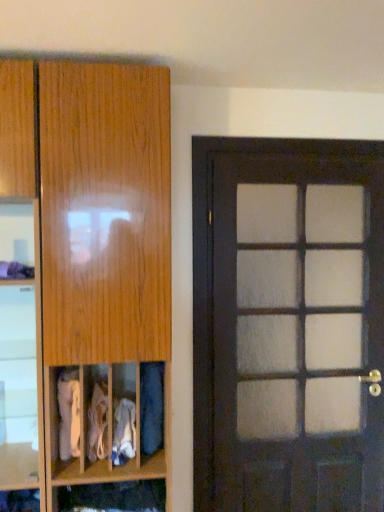
Question: Can you confirm if wooden cabinet at lower center is positioned to the left of white fabric at center, arranged as the 3th clothing when viewed from the left?

Choices:
 (A) no
 (B) yes

Answer: (B)

Question: Could you tell me if wooden cabinet at lower center is facing white fabric at center, which is the second clothing in right-to-left order?

Choices:
 (A) no
 (B) yes

Answer: (A)

Question: Considering the relative sizes of wooden cabinet at lower center and white fabric at center, arranged as the 3th clothing when viewed from the left, in the image provided, is wooden cabinet at lower center bigger than white fabric at center, arranged as the 3th clothing when viewed from the left,?

Choices:
 (A) no
 (B) yes

Answer: (B)

Question: Does wooden cabinet at lower center have a lesser height compared to white fabric at center, which is the second clothing in right-to-left order?

Choices:
 (A) no
 (B) yes

Answer: (B)

Question: From a real-world perspective, is wooden cabinet at lower center positioned under white fabric at center, which is the second clothing in right-to-left order, based on gravity?

Choices:
 (A) no
 (B) yes

Answer: (B)

Question: Considering their positions, is white fabric at lower left, placed as the 1th clothing when sorted from left to right, located in front of or behind blue fabric at lower left, the first clothing viewed from the right?

Choices:
 (A) behind
 (B) front

Answer: (B)

Question: Would you say white fabric at lower left, which is the 4th clothing from right to left, is to the left or to the right of blue fabric at lower left, the 4th clothing when ordered from left to right, in the picture?

Choices:
 (A) left
 (B) right

Answer: (A)

Question: Is white fabric at lower left, which is the 4th clothing from right to left, inside or outside of blue fabric at lower left, the first clothing viewed from the right?

Choices:
 (A) outside
 (B) inside

Answer: (A)

Question: Is white fabric at lower left, placed as the 1th clothing when sorted from left to right, wider or thinner than blue fabric at lower left, the 4th clothing when ordered from left to right?

Choices:
 (A) thin
 (B) wide

Answer: (B)

Question: Is dark wood door at right situated inside white fabric at lower left, placed as the 1th clothing when sorted from left to right, or outside?

Choices:
 (A) inside
 (B) outside

Answer: (B)

Question: From the image's perspective, is dark wood door at right located above or below white fabric at lower left, which is the 4th clothing from right to left?

Choices:
 (A) below
 (B) above

Answer: (B)

Question: Considering the relative positions of dark wood door at right and white fabric at lower left, placed as the 1th clothing when sorted from left to right, in the image provided, is dark wood door at right to the left or to the right of white fabric at lower left, placed as the 1th clothing when sorted from left to right,?

Choices:
 (A) right
 (B) left

Answer: (A)

Question: Is dark wood door at right in front of or behind white fabric at lower left, placed as the 1th clothing when sorted from left to right, in the image?

Choices:
 (A) behind
 (B) front

Answer: (A)

Question: Based on their positions, is wooden cabinet at left located to the left or right of white fabric at lower left, which is the 4th clothing from right to left?

Choices:
 (A) right
 (B) left

Answer: (A)

Question: In terms of width, does wooden cabinet at left look wider or thinner when compared to white fabric at lower left, placed as the 1th clothing when sorted from left to right?

Choices:
 (A) wide
 (B) thin

Answer: (A)